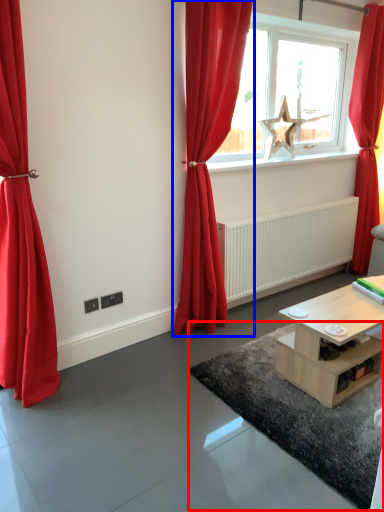
Question: Which object appears farthest to the camera in this image, plain (highlighted by a red box) or curtain (highlighted by a blue box)?

Choices:
 (A) plain
 (B) curtain

Answer: (B)